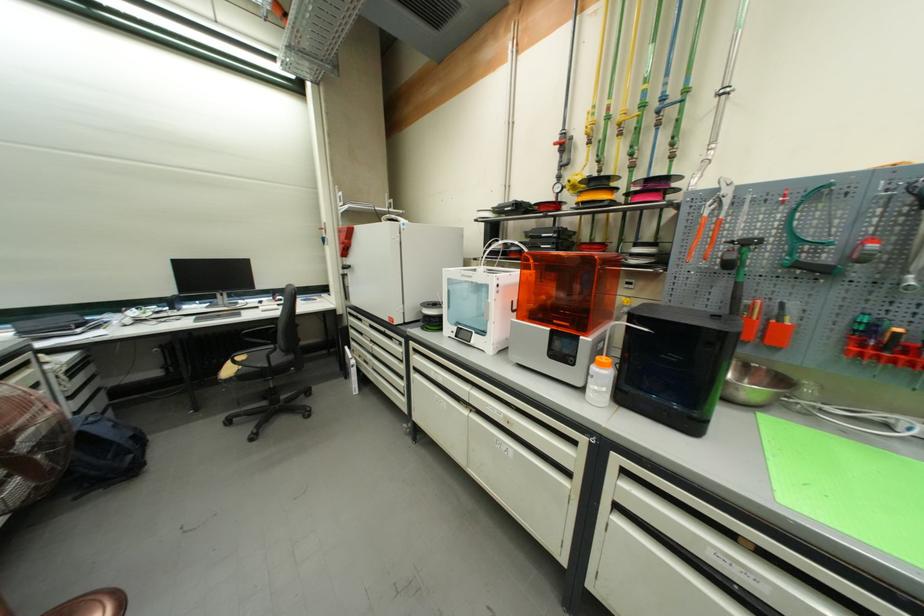
The location [738,267] corresponds to which object?

This point indicates the metal wrench.